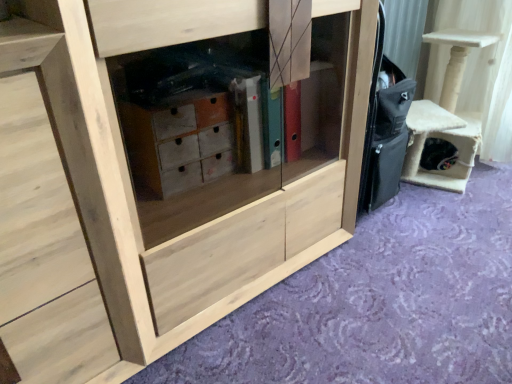
Question: From a real-world perspective, is beige felt cat house at right positioned over natural wood cabinet at center based on gravity?

Choices:
 (A) yes
 (B) no

Answer: (B)

Question: Can you confirm if beige felt cat house at right is smaller than natural wood cabinet at center?

Choices:
 (A) yes
 (B) no

Answer: (A)

Question: Is beige felt cat house at right shorter than natural wood cabinet at center?

Choices:
 (A) no
 (B) yes

Answer: (B)

Question: Is beige felt cat house at right wider than natural wood cabinet at center?

Choices:
 (A) no
 (B) yes

Answer: (A)

Question: Is beige felt cat house at right turned away from natural wood cabinet at center?

Choices:
 (A) no
 (B) yes

Answer: (A)

Question: Relative to beige felt cat house at right, is natural wood cabinet at center in front or behind?

Choices:
 (A) behind
 (B) front

Answer: (B)

Question: From the image's perspective, is natural wood cabinet at center positioned above or below beige felt cat house at right?

Choices:
 (A) above
 (B) below

Answer: (B)

Question: Looking at the image, does natural wood cabinet at center seem bigger or smaller compared to beige felt cat house at right?

Choices:
 (A) small
 (B) big

Answer: (B)

Question: Would you say natural wood cabinet at center is to the left or to the right of beige felt cat house at right in the picture?

Choices:
 (A) right
 (B) left

Answer: (B)

Question: Based on their sizes in the image, would you say beige felt cat house at right is bigger or smaller than natural wood cabinet at center?

Choices:
 (A) big
 (B) small

Answer: (B)

Question: Which is correct: beige felt cat house at right is inside natural wood cabinet at center, or outside of it?

Choices:
 (A) inside
 (B) outside

Answer: (B)

Question: Considering the positions of beige felt cat house at right and natural wood cabinet at center in the image, is beige felt cat house at right taller or shorter than natural wood cabinet at center?

Choices:
 (A) short
 (B) tall

Answer: (A)

Question: In terms of width, does beige felt cat house at right look wider or thinner when compared to natural wood cabinet at center?

Choices:
 (A) wide
 (B) thin

Answer: (B)

Question: Considering the positions of point (130, 180) and point (92, 119), is point (130, 180) closer or farther from the camera than point (92, 119)?

Choices:
 (A) farther
 (B) closer

Answer: (A)

Question: From a real-world perspective, is natural wood cabinet at center above or below natural wood cabinet at lower left?

Choices:
 (A) above
 (B) below

Answer: (A)